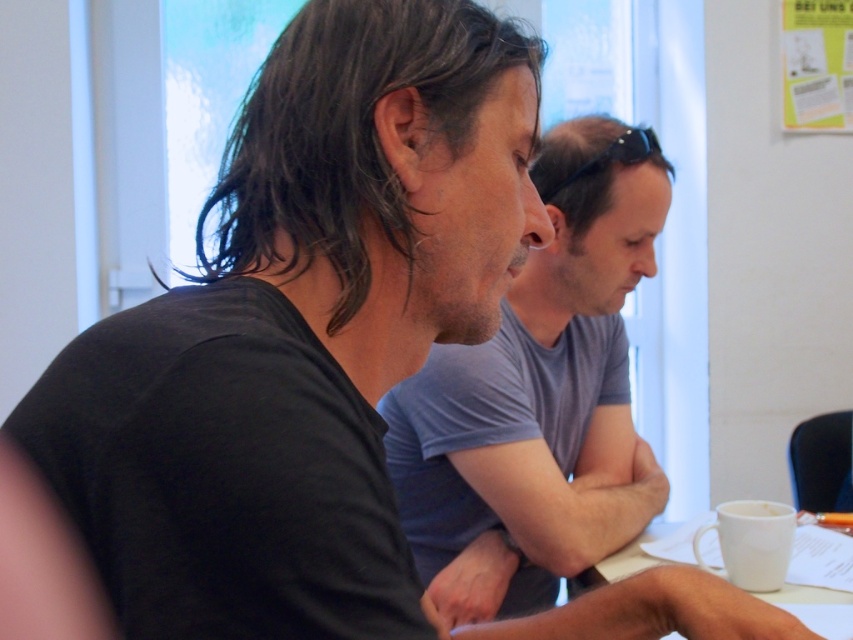
Consider the image. You are an assistant who needs to determine which object takes up more space in the image. Based on the scene, which is larger between the matte black shirt at center and the dark brown wavy hair at center?

The matte black shirt at center is larger in size than the dark brown wavy hair at center, so the matte black shirt at center takes up more space in the image.

You are a photographer trying to capture a candid shot of both the matte black shirt at center and the dark brown hair at upper right. However, you can only focus on one subject at a time. Based on their positions, which subject should you focus on first to ensure the other is still in frame?

The matte black shirt at center is positioned under dark brown hair at upper right. Therefore, focusing on the dark brown hair at upper right first will keep the matte black shirt at center in the frame below it.